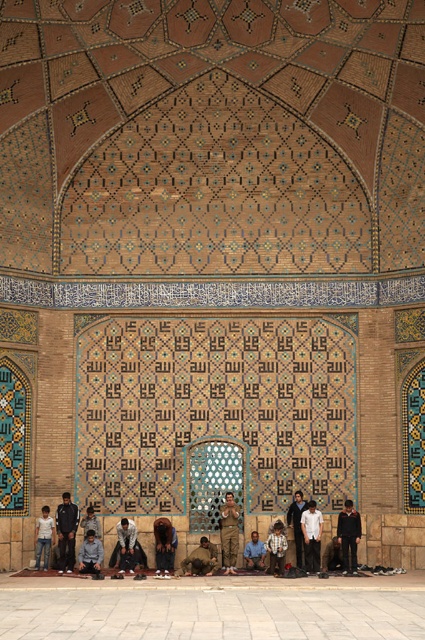
Question: Which object is closer to the camera taking this photo?

Choices:
 (A) light blue jeans at lower left
 (B) brown cotton pants at center
 (C) dark brown leather jacket at center

Answer: (A)

Question: Which object appears farthest from the camera in this image?

Choices:
 (A) camouflage fabric person at center
 (B) brown leather shoes at lower center

Answer: (B)

Question: Considering the relative positions of dark brown leather jacket at center and light gray fabric at lower center in the image provided, where is dark brown leather jacket at center located with respect to light gray fabric at lower center?

Choices:
 (A) below
 (B) above

Answer: (A)

Question: Is the position of brown cotton pants at center less distant than that of white cotton shirt at center?

Choices:
 (A) no
 (B) yes

Answer: (A)

Question: Which point is farther to the camera?

Choices:
 (A) (235, 536)
 (B) (308, 547)

Answer: (A)

Question: Does dark blue fabric at lower left appear under dark blue jeans at center?

Choices:
 (A) yes
 (B) no

Answer: (A)